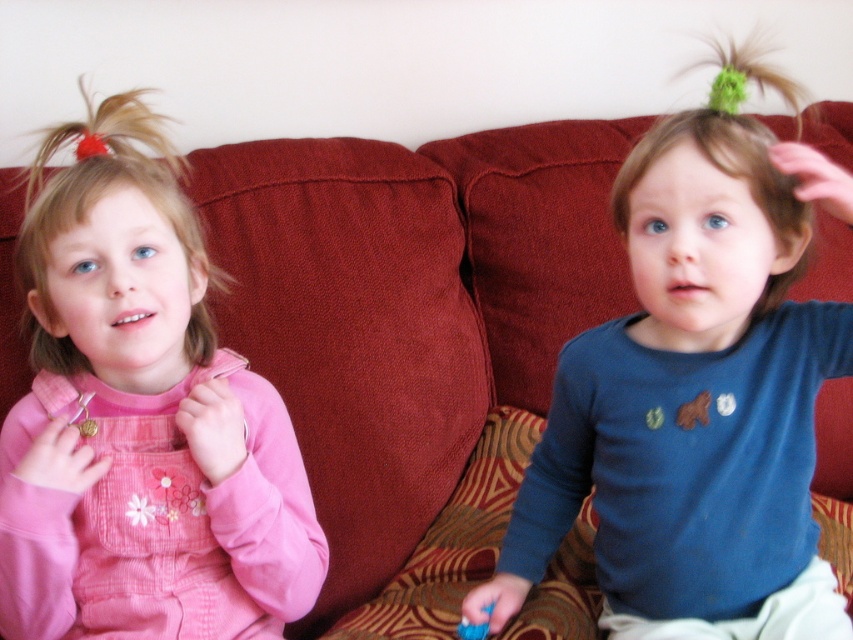
Between blue cotton shirt at center and brown fuzzy hair at upper right, which one has more height?

blue cotton shirt at center

Find the location of a particular element. This screenshot has height=640, width=853. blue cotton shirt at center is located at coordinates (695, 392).

Where is `blue cotton shirt at center`? The image size is (853, 640). blue cotton shirt at center is located at coordinates (695, 392).

I want to click on blue cotton shirt at center, so click(x=695, y=392).

Is point (750, 328) closer to viewer compared to point (80, 484)?

No.

Identify the location of blue cotton shirt at center. The height and width of the screenshot is (640, 853). (695, 392).

Can you confirm if blue cotton shirt at center is smaller than blue plastic brush at lower center?

Incorrect, blue cotton shirt at center is not smaller in size than blue plastic brush at lower center.

Can you confirm if blue cotton shirt at center is positioned to the left of blue plastic brush at lower center?

Incorrect, blue cotton shirt at center is not on the left side of blue plastic brush at lower center.

The height and width of the screenshot is (640, 853). What do you see at coordinates (695, 392) in the screenshot?
I see `blue cotton shirt at center` at bounding box center [695, 392].

Locate an element on the screen. blue cotton shirt at center is located at coordinates (695, 392).